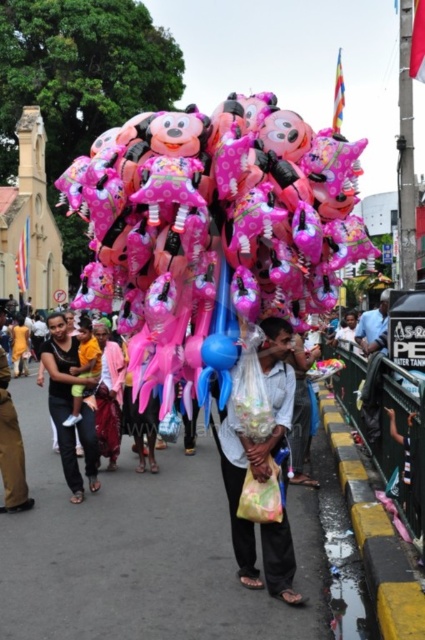
Can you confirm if pink matte balloons at center is smaller than matte pink balloons at center?

No, pink matte balloons at center is not smaller than matte pink balloons at center.

Which is in front, point (302, 140) or point (254, 582)?

Positioned in front is point (302, 140).

The height and width of the screenshot is (640, 425). Find the location of `pink matte balloons at center`. pink matte balloons at center is located at coordinates (212, 227).

Can you confirm if matte pink balloons at center is positioned to the right of blue rubber balloon at center?

Correct, you'll find matte pink balloons at center to the right of blue rubber balloon at center.

Measure the distance from matte pink balloons at center to blue rubber balloon at center.

They are 3.61 meters apart.

Measure the distance between matte pink balloons at center and camera.

A distance of 24.55 meters exists between matte pink balloons at center and camera.

Locate an element on the screen. The width and height of the screenshot is (425, 640). matte pink balloons at center is located at coordinates (257, 442).

Who is shorter, matte pink balloons at center or brown leather pants at lower left?

brown leather pants at lower left is shorter.

Does matte pink balloons at center have a greater height compared to brown leather pants at lower left?

Yes, matte pink balloons at center is taller than brown leather pants at lower left.

Where is `matte pink balloons at center`? This screenshot has height=640, width=425. matte pink balloons at center is located at coordinates (257, 442).

This screenshot has width=425, height=640. Find the location of `matte pink balloons at center`. matte pink balloons at center is located at coordinates (257, 442).